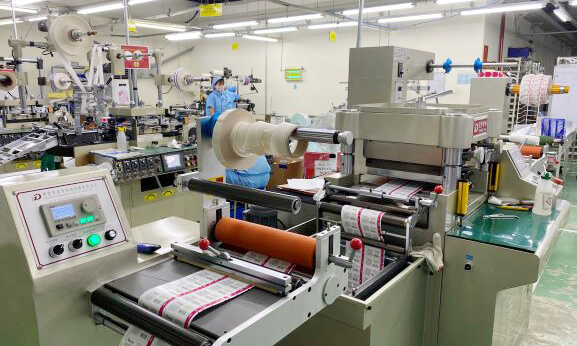
Where is `ceiling`? The image size is (577, 346). ceiling is located at coordinates (173, 9).